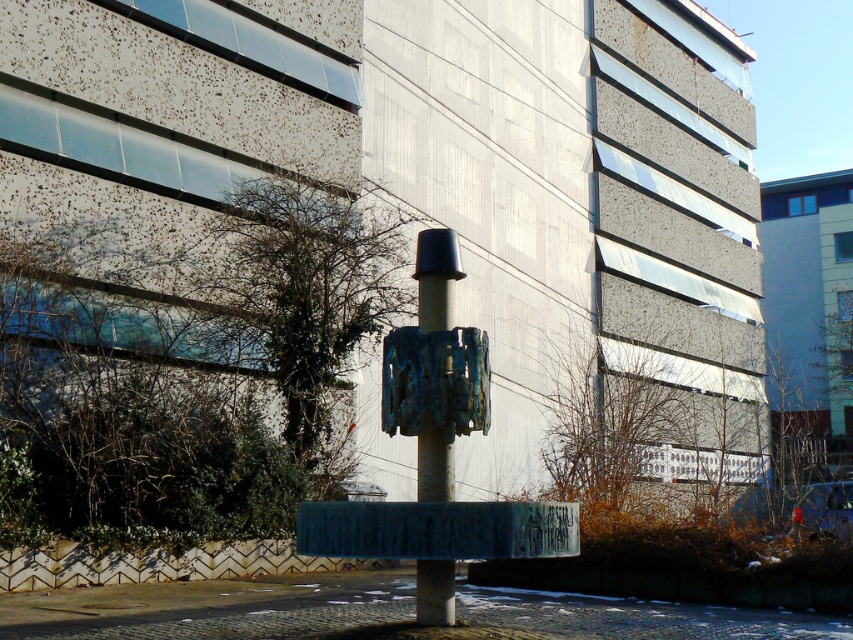
You are standing in the urban setting shown in the image. There is a point marked at coordinates [438,529]. What material is present at that point?

The material at point [438,529] is green painted concrete.